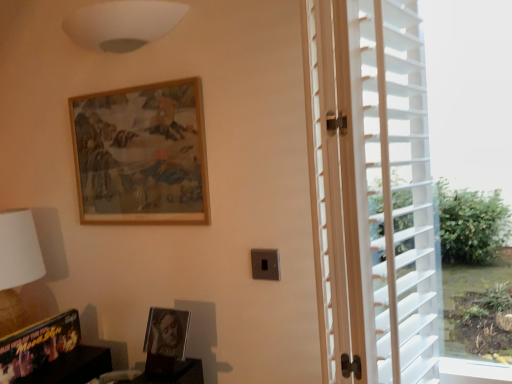
What do you see at coordinates (375, 198) in the screenshot? This screenshot has height=384, width=512. I see `white wooden blinds at right` at bounding box center [375, 198].

In order to face wooden frame at upper center, placed as the 1th picture frame when sorted from top to bottom, should I rotate leftwards or rightwards?

Turn left by 16.089 degrees to look at wooden frame at upper center, placed as the 1th picture frame when sorted from top to bottom.

Looking at this image, what is the approximate width of white fabric lampshade at left?

white fabric lampshade at left is 9.13 inches wide.

What do you see at coordinates (167, 332) in the screenshot? The height and width of the screenshot is (384, 512). I see `matte black picture frame at lower center, arranged as the second picture frame when ordered from the bottom` at bounding box center [167, 332].

Find the location of a particular element. This screenshot has height=384, width=512. dark wood bookshelf at lower left is located at coordinates (72, 367).

Find the location of `white plastic blinds at right`. white plastic blinds at right is located at coordinates (470, 91).

The image size is (512, 384). I want to click on white wooden blinds at right, so click(x=375, y=198).

This screenshot has width=512, height=384. I want to click on picture frame that is on the left side of dark wood bookshelf at lower left, so click(x=38, y=345).

Would you say dark wood bookshelf at lower left is a long distance from wooden picture frame at lower left, the 1th picture frame in the bottom-to-top sequence?

dark wood bookshelf at lower left is near wooden picture frame at lower left, the 1th picture frame in the bottom-to-top sequence, not far away.

Is dark wood bookshelf at lower left outside of wooden picture frame at lower left, the 1th picture frame in the bottom-to-top sequence?

That's correct, dark wood bookshelf at lower left is outside of wooden picture frame at lower left, the 1th picture frame in the bottom-to-top sequence.

Which object is positioned more to the left, dark wood bookshelf at lower left or wooden picture frame at lower left, marked as the 3th picture frame in a top-to-bottom arrangement?

wooden picture frame at lower left, marked as the 3th picture frame in a top-to-bottom arrangement.

Does white matte lampshade at upper center appear on the left side of matte black picture frame at lower center, which ranks as the 2th picture frame in top-to-bottom order?

Indeed, white matte lampshade at upper center is positioned on the left side of matte black picture frame at lower center, which ranks as the 2th picture frame in top-to-bottom order.

Considering the positions of point (85, 41) and point (166, 310), is point (85, 41) closer or farther from the camera than point (166, 310)?

Point (85, 41) is farther from the camera than point (166, 310).

From a real-world perspective, is white matte lampshade at upper center located beneath matte black picture frame at lower center, which ranks as the 2th picture frame in top-to-bottom order?

No.

From the image's perspective, which is below, white matte lampshade at upper center or matte black picture frame at lower center, which ranks as the 2th picture frame in top-to-bottom order?

matte black picture frame at lower center, which ranks as the 2th picture frame in top-to-bottom order, appears lower in the image.

Is wooden frame at upper center, placed as the 1th picture frame when sorted from top to bottom, not close to dark wood bookshelf at lower left?

They are positioned close to each other.

Which is closer to the camera, (175, 196) or (70, 358)?

Point (175, 196) is closer to the camera than point (70, 358).

Does wooden frame at upper center, which is the third picture frame in bottom-to-top order, turn towards dark wood bookshelf at lower left?

No, wooden frame at upper center, which is the third picture frame in bottom-to-top order, is not aimed at dark wood bookshelf at lower left.

Does wooden frame at upper center, placed as the 1th picture frame when sorted from top to bottom, come behind dark wood bookshelf at lower left?

Yes.

Could you measure the distance between wooden frame at upper center, which is the third picture frame in bottom-to-top order, and wooden picture frame at lower left, the 1th picture frame in the bottom-to-top sequence?

wooden frame at upper center, which is the third picture frame in bottom-to-top order, is 20.42 inches from wooden picture frame at lower left, the 1th picture frame in the bottom-to-top sequence.

Is point (162, 83) closer or farther from the camera than point (74, 330)?

Point (162, 83).

Is wooden frame at upper center, placed as the 1th picture frame when sorted from top to bottom, further to the viewer compared to wooden picture frame at lower left, the 1th picture frame in the bottom-to-top sequence?

That is True.

Can you see wooden frame at upper center, placed as the 1th picture frame when sorted from top to bottom, touching wooden picture frame at lower left, marked as the 3th picture frame in a top-to-bottom arrangement?

No, wooden frame at upper center, placed as the 1th picture frame when sorted from top to bottom, is not making contact with wooden picture frame at lower left, marked as the 3th picture frame in a top-to-bottom arrangement.

Which object is further away from the camera, wooden picture frame at lower left, marked as the 3th picture frame in a top-to-bottom arrangement, or dark wood bookshelf at lower left?

dark wood bookshelf at lower left is further from the camera.

Is wooden picture frame at lower left, marked as the 3th picture frame in a top-to-bottom arrangement, positioned with its back to dark wood bookshelf at lower left?

No, wooden picture frame at lower left, marked as the 3th picture frame in a top-to-bottom arrangement, is not facing away from dark wood bookshelf at lower left.

Considering the sizes of objects wooden picture frame at lower left, the 1th picture frame in the bottom-to-top sequence, and dark wood bookshelf at lower left in the image provided, who is bigger, wooden picture frame at lower left, the 1th picture frame in the bottom-to-top sequence, or dark wood bookshelf at lower left?

Bigger between the two is wooden picture frame at lower left, the 1th picture frame in the bottom-to-top sequence.

In terms of width, does wooden picture frame at lower left, the 1th picture frame in the bottom-to-top sequence, look wider or thinner when compared to dark wood bookshelf at lower left?

Clearly, wooden picture frame at lower left, the 1th picture frame in the bottom-to-top sequence, has more width compared to dark wood bookshelf at lower left.

From the image's perspective, is white fabric lampshade at left located above or below white plastic blinds at right?

From the image's perspective, white fabric lampshade at left appears below white plastic blinds at right.

Is white fabric lampshade at left bigger than white plastic blinds at right?

Actually, white fabric lampshade at left might be smaller than white plastic blinds at right.

From a real-world perspective, is white fabric lampshade at left beneath white plastic blinds at right?

Yes, from a real-world perspective, white fabric lampshade at left is below white plastic blinds at right.

Who is bigger, wooden frame at upper center, which is the third picture frame in bottom-to-top order, or white fabric lampshade at left?

white fabric lampshade at left is bigger.

Does wooden frame at upper center, placed as the 1th picture frame when sorted from top to bottom, have a lesser height compared to white fabric lampshade at left?

Indeed, wooden frame at upper center, placed as the 1th picture frame when sorted from top to bottom, has a lesser height compared to white fabric lampshade at left.

Which point is more forward, (87,184) or (10,326)?

Positioned in front is point (10,326).

Are wooden frame at upper center, placed as the 1th picture frame when sorted from top to bottom, and white fabric lampshade at left far apart?

No, wooden frame at upper center, placed as the 1th picture frame when sorted from top to bottom, is in close proximity to white fabric lampshade at left.

Where is `furniture located behind the wooden picture frame at lower left, marked as the 3th picture frame in a top-to-bottom arrangement`? furniture located behind the wooden picture frame at lower left, marked as the 3th picture frame in a top-to-bottom arrangement is located at coordinates (72, 367).

Image resolution: width=512 pixels, height=384 pixels. Find the location of `lamp lying on the left of matte black picture frame at lower center, which ranks as the 2th picture frame in top-to-bottom order`. lamp lying on the left of matte black picture frame at lower center, which ranks as the 2th picture frame in top-to-bottom order is located at coordinates (122, 24).

Considering their positions, is white plastic blinds at right positioned closer to matte black picture frame at lower center, arranged as the second picture frame when ordered from the bottom, than white matte lampshade at upper center?

white matte lampshade at upper center.

When comparing their distances from white matte lampshade at upper center, does wooden frame at upper center, placed as the 1th picture frame when sorted from top to bottom, or white wooden blinds at right seem closer?

wooden frame at upper center, placed as the 1th picture frame when sorted from top to bottom, lies closer to white matte lampshade at upper center than the other object.

Based on their spatial positions, is white fabric lampshade at left or dark wood bookshelf at lower left closer to white matte lampshade at upper center?

The object closer to white matte lampshade at upper center is white fabric lampshade at left.

Looking at the image, which one is located closer to white plastic blinds at right, wooden picture frame at lower left, marked as the 3th picture frame in a top-to-bottom arrangement, or dark wood bookshelf at lower left?

dark wood bookshelf at lower left lies closer to white plastic blinds at right than the other object.

Considering their positions, is white wooden blinds at right positioned closer to matte black picture frame at lower center, which ranks as the 2th picture frame in top-to-bottom order, than white matte lampshade at upper center?

white wooden blinds at right is closer to matte black picture frame at lower center, which ranks as the 2th picture frame in top-to-bottom order.

Based on their spatial positions, is wooden frame at upper center, placed as the 1th picture frame when sorted from top to bottom, or matte black picture frame at lower center, which ranks as the 2th picture frame in top-to-bottom order, closer to white fabric lampshade at left?

The object closer to white fabric lampshade at left is wooden frame at upper center, placed as the 1th picture frame when sorted from top to bottom.

Estimate the real-world distances between objects in this image. Which object is closer to white wooden blinds at right, white fabric lampshade at left or matte black picture frame at lower center, arranged as the second picture frame when ordered from the bottom?

Among the two, matte black picture frame at lower center, arranged as the second picture frame when ordered from the bottom, is located nearer to white wooden blinds at right.

Estimate the real-world distances between objects in this image. Which object is further from white wooden blinds at right, white plastic blinds at right or matte black picture frame at lower center, arranged as the second picture frame when ordered from the bottom?

Based on the image, matte black picture frame at lower center, arranged as the second picture frame when ordered from the bottom, appears to be further to white wooden blinds at right.

Locate an element on the screen. Image resolution: width=512 pixels, height=384 pixels. table lamp that lies between white matte lampshade at upper center and matte black picture frame at lower center, arranged as the second picture frame when ordered from the bottom, from top to bottom is located at coordinates (17, 265).

At what (x,y) coordinates should I click in order to perform the action: click on furniture between wooden picture frame at lower left, the 1th picture frame in the bottom-to-top sequence, and matte black picture frame at lower center, arranged as the second picture frame when ordered from the bottom. Please return your answer as a coordinate pair (x, y). The width and height of the screenshot is (512, 384). Looking at the image, I should click on (x=72, y=367).

Where is `window between matte black picture frame at lower center, which ranks as the 2th picture frame in top-to-bottom order, and white plastic blinds at right from left to right`? The image size is (512, 384). window between matte black picture frame at lower center, which ranks as the 2th picture frame in top-to-bottom order, and white plastic blinds at right from left to right is located at coordinates (375, 198).

Locate an element on the screen. This screenshot has height=384, width=512. furniture situated between white fabric lampshade at left and matte black picture frame at lower center, arranged as the second picture frame when ordered from the bottom, from left to right is located at coordinates (72, 367).